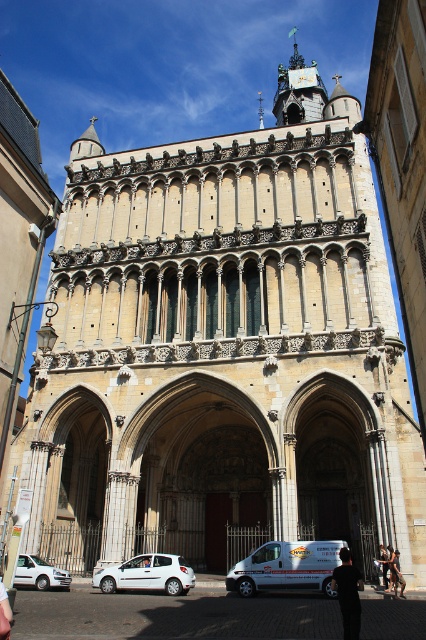
In the scene shown: You are a delivery person who needs to park your white van at lower center near the historic building. However, there is a brown leather jacket at lower center in the way. Can your van fit through the space between the jacket and the building?

The white van at lower center is taller than the brown leather jacket at lower center. Since the jacket is in the way, you need to move it first before the van can pass through the space between the jacket and the building.

You are a pedestrian standing at the entrance of the historic building and see a white van at lower center and a white fabric person at center. Which object is closer to the entrance?

The white fabric person at center is closer to the entrance because the white van at lower center is to the right of the white fabric person at center, implying the van is further away from the entrance.

You are a pedestrian standing on the sidewalk in front of the historic building. You see a white matte hatchback at lower left and dark gray fabric pants at center. Which object is closer to the left side of the building?

The white matte hatchback at lower left is closer to the left side of the building because it is positioned to the left of the dark gray fabric pants at center.